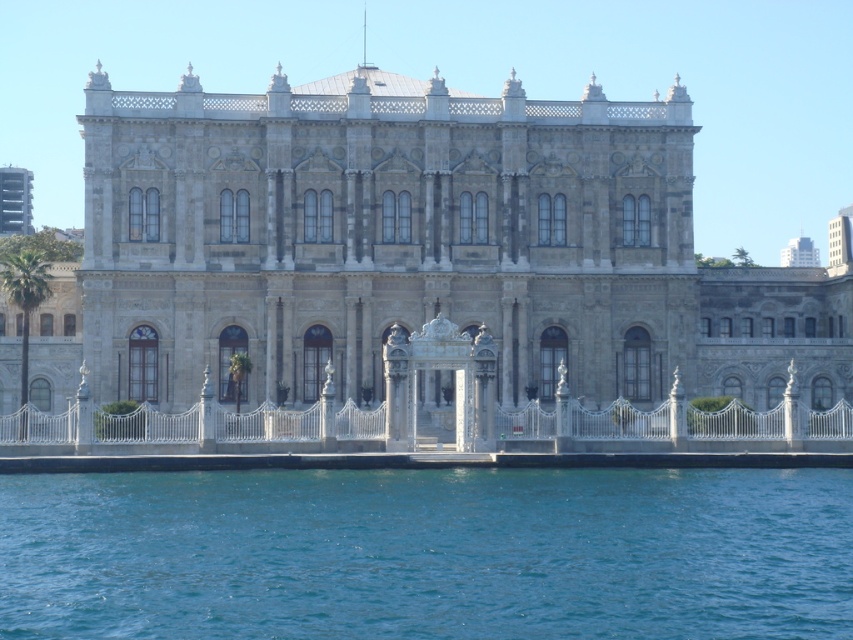
The height and width of the screenshot is (640, 853). In order to click on stone building at center in this screenshot , I will do `click(413, 248)`.

Who is positioned more to the right, stone building at center or blue liquid water at lower center?

Positioned to the right is stone building at center.

Find the location of a particular element. stone building at center is located at coordinates (413, 248).

This screenshot has height=640, width=853. What are the coordinates of `stone building at center` in the screenshot? It's located at (413, 248).